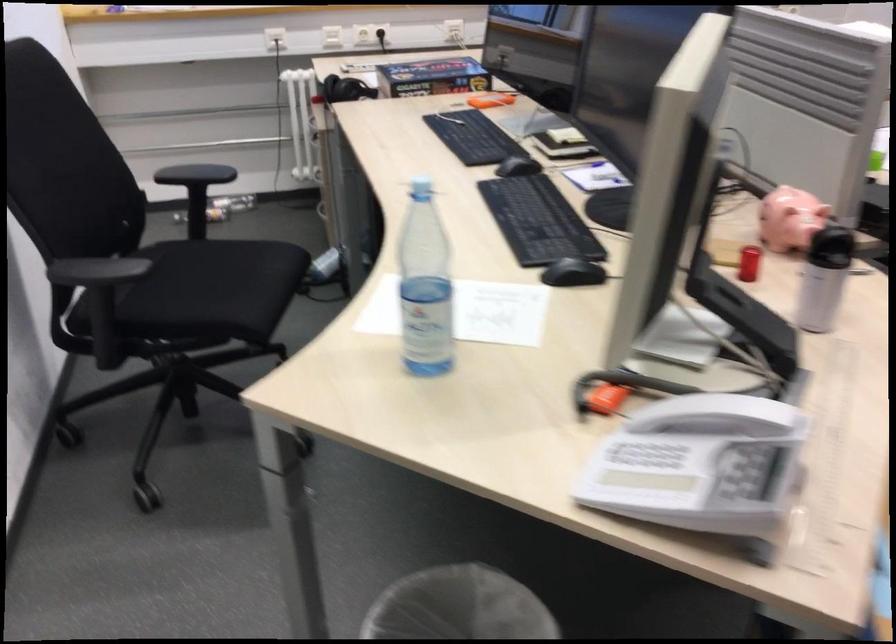
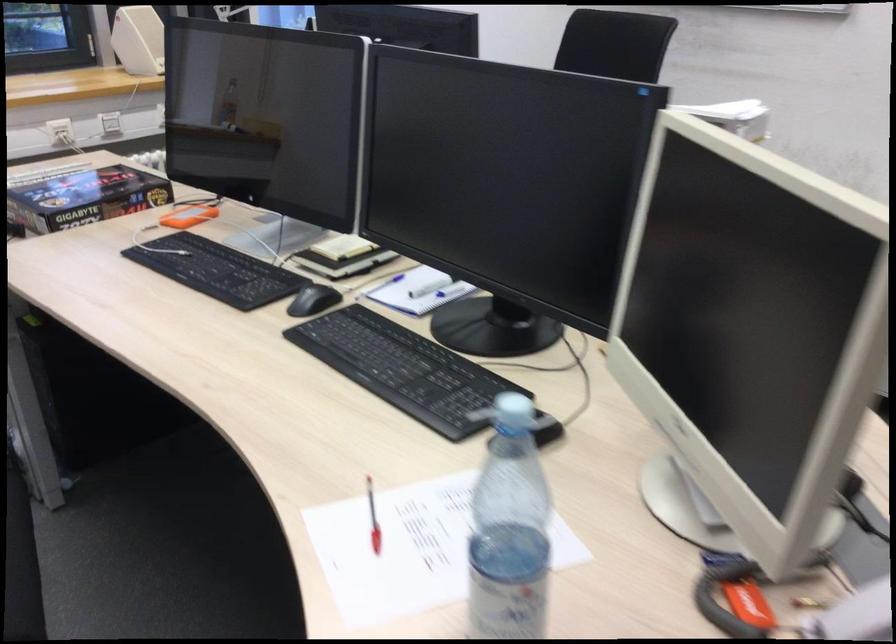
Find the pixel in the second image that matches (415,180) in the first image.

(513, 410)